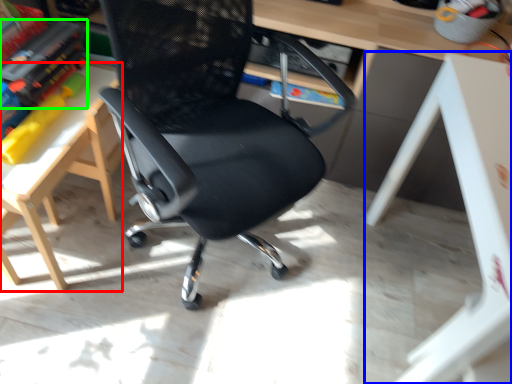
Question: Which object is the closest to the table (highlighted by a red box)? Choose among these: table (highlighted by a blue box) or book (highlighted by a green box).

Choices:
 (A) table
 (B) book

Answer: (B)